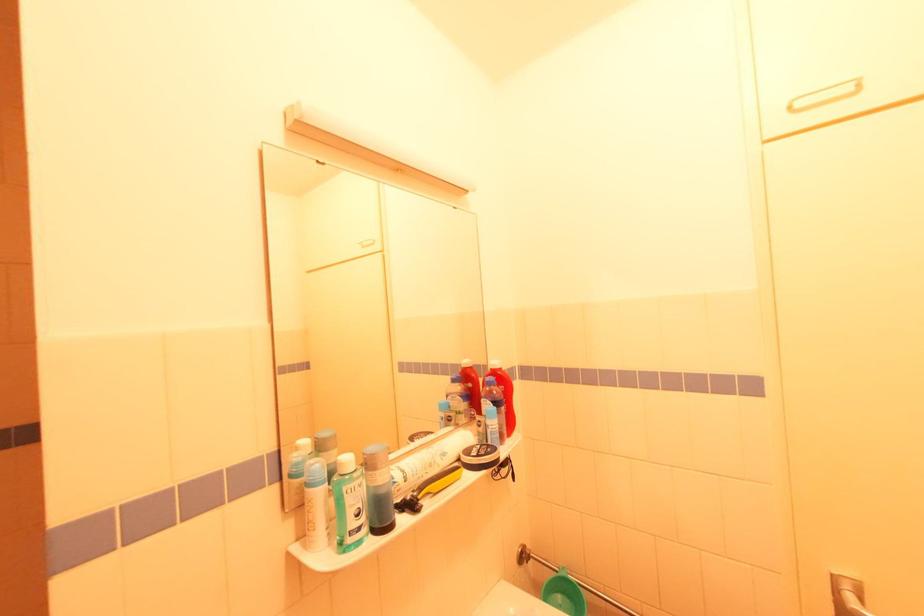
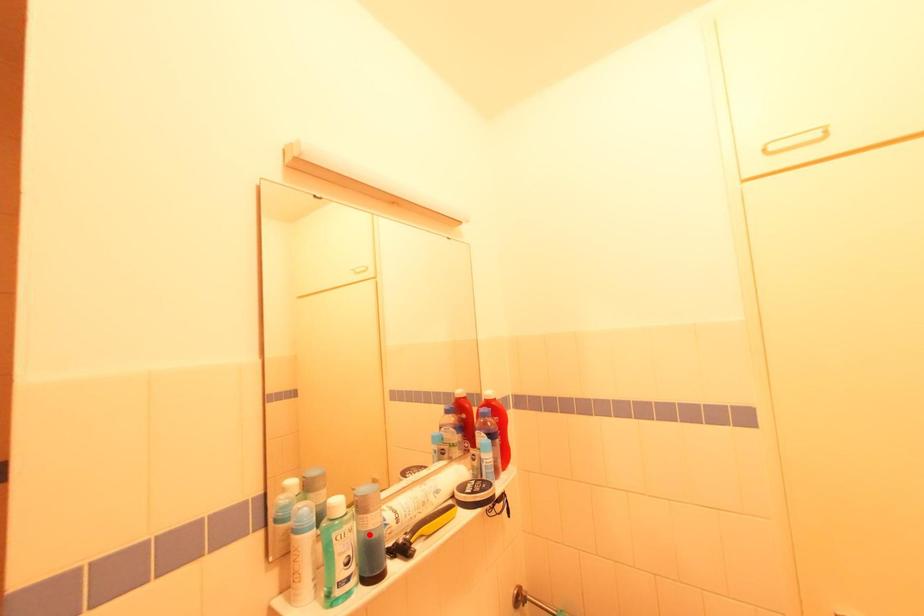
I am providing you with two images of the same scene from different viewpoints. A red point is marked on the first image and another point is marked on the second image. Do the highlighted points in image1 and image2 indicate the same real-world spot?

No